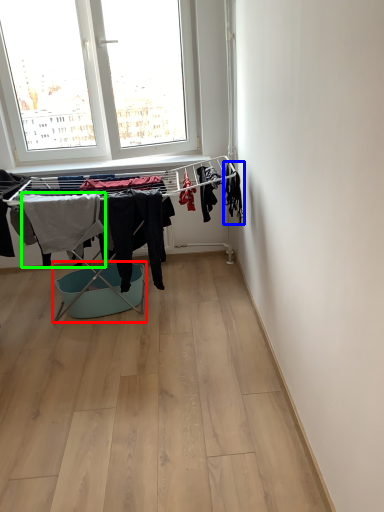
Question: Estimate the real-world distances between objects in this image. Which object is closer to laundry basket (highlighted by a red box), clothing (highlighted by a blue box) or clothing (highlighted by a green box)?

Choices:
 (A) clothing
 (B) clothing

Answer: (B)